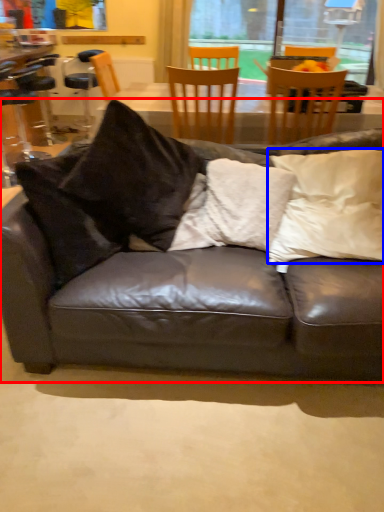
Question: Which object is further to the camera taking this photo, studio couch (highlighted by a red box) or pillow (highlighted by a blue box)?

Choices:
 (A) studio couch
 (B) pillow

Answer: (B)